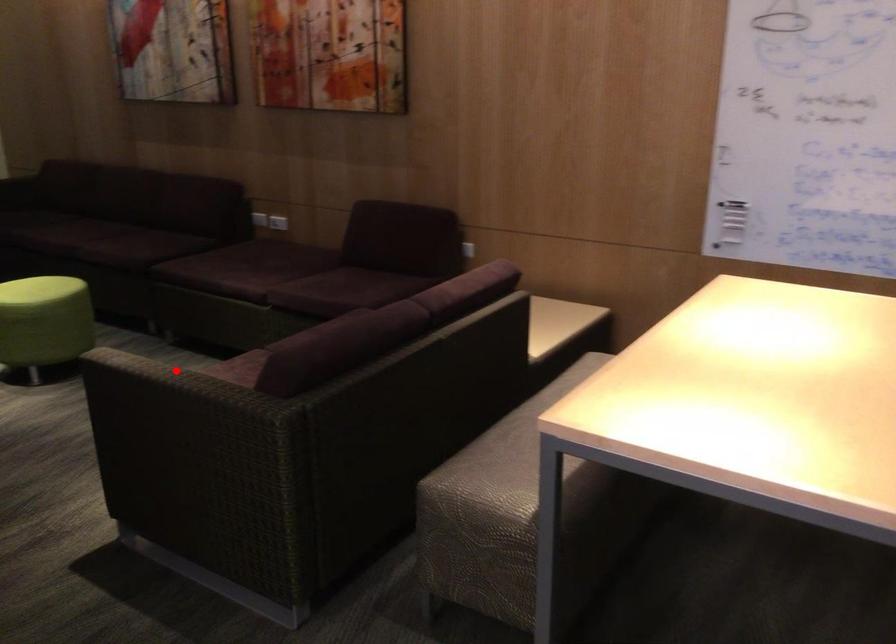
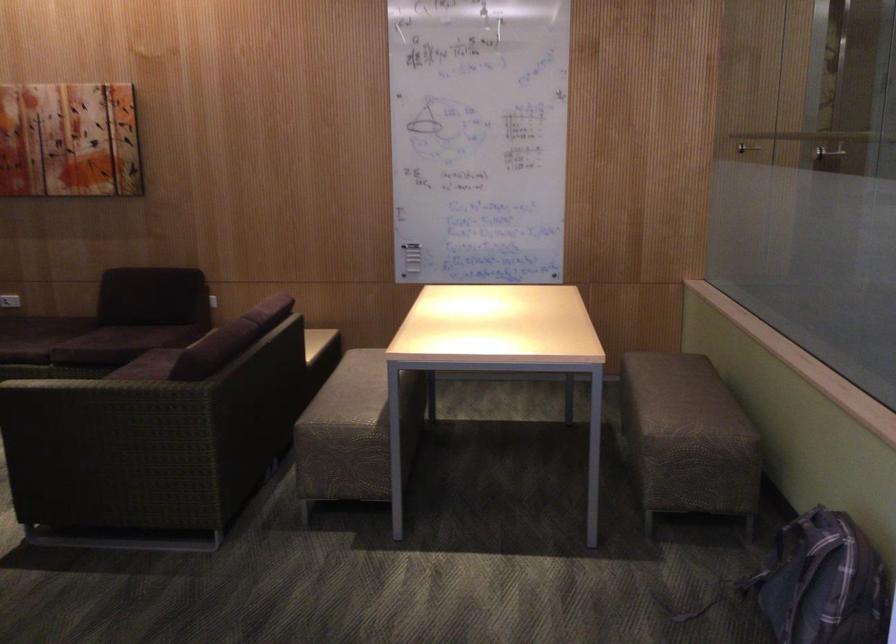
Where in the second image is the point corresponding to the highlighted location from the first image?

(96, 382)